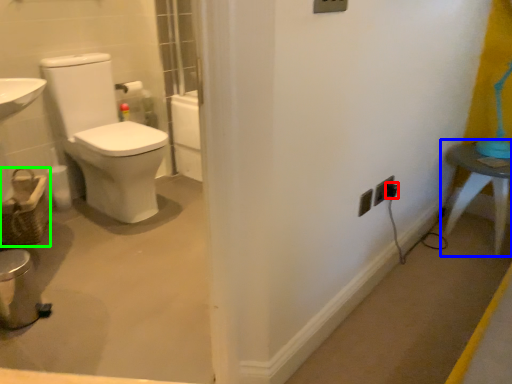
Question: Which object is the closest to the electric outlet (highlighted by a red box)? Choose among these: table (highlighted by a blue box) or basket (highlighted by a green box).

Choices:
 (A) table
 (B) basket

Answer: (A)